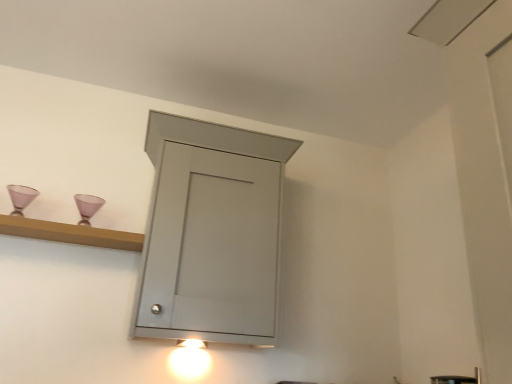
The image size is (512, 384). Describe the element at coordinates (189, 359) in the screenshot. I see `matte white light fixture at lower center` at that location.

Where is `matte white light fixture at lower center`? Image resolution: width=512 pixels, height=384 pixels. matte white light fixture at lower center is located at coordinates (189, 359).

Locate an element on the screen. matte gray cabinet at center is located at coordinates (193, 215).

From the image's perspective, is wooden shelf at upper left located above or below satin nickel faucet at lower right?

From the image's perspective, wooden shelf at upper left appears above satin nickel faucet at lower right.

Is wooden shelf at upper left further to the viewer compared to satin nickel faucet at lower right?

Yes, the depth of wooden shelf at upper left is greater than that of satin nickel faucet at lower right.

From a real-world perspective, which is physically below, wooden shelf at upper left or satin nickel faucet at lower right?

satin nickel faucet at lower right, from a real-world perspective.

Is wooden shelf at upper left next to satin nickel faucet at lower right and touching it?

They are not placed beside each other.

Considering the relative positions of wooden shelf at upper left and matte white light fixture at lower center in the image provided, is wooden shelf at upper left in front of matte white light fixture at lower center?

Yes, wooden shelf at upper left is closer to the camera.

I want to click on shelf above the matte white light fixture at lower center (from the image's perspective), so click(x=70, y=233).

From the image's perspective, is wooden shelf at upper left located above or below matte white light fixture at lower center?

wooden shelf at upper left is situated higher than matte white light fixture at lower center in the image.

Does point (6, 228) come behind point (190, 348)?

No, it is not.

Is satin nickel faucet at lower right bigger or smaller than wooden shelf at upper left?

Clearly, satin nickel faucet at lower right is smaller in size than wooden shelf at upper left.

Which of these two, satin nickel faucet at lower right or wooden shelf at upper left, is wider?

Wider between the two is wooden shelf at upper left.

From the image's perspective, is satin nickel faucet at lower right above wooden shelf at upper left?

No, from the image's perspective, satin nickel faucet at lower right is not above wooden shelf at upper left.

Which is closer to the camera, (453,377) or (71,241)?

Positioned in front is point (453,377).

Considering the sizes of satin nickel faucet at lower right and matte gray cabinet at center in the image, is satin nickel faucet at lower right taller or shorter than matte gray cabinet at center?

Clearly, satin nickel faucet at lower right is shorter compared to matte gray cabinet at center.

From the image's perspective, is satin nickel faucet at lower right above matte gray cabinet at center?

Actually, satin nickel faucet at lower right appears below matte gray cabinet at center in the image.

Considering the relative positions of satin nickel faucet at lower right and matte gray cabinet at center in the image provided, is satin nickel faucet at lower right to the left of matte gray cabinet at center from the viewer's perspective?

No, satin nickel faucet at lower right is not to the left of matte gray cabinet at center.

Find the location of a particular element. The width and height of the screenshot is (512, 384). faucet located underneath the matte gray cabinet at center (from a real-world perspective) is located at coordinates (457, 379).

Is point (223, 319) in front of point (430, 377)?

Yes.

In order to click on cupboard behind the satin nickel faucet at lower right in this screenshot , I will do `click(193, 215)`.

Could you tell me if matte gray cabinet at center is facing satin nickel faucet at lower right?

No, matte gray cabinet at center is not aimed at satin nickel faucet at lower right.

From a real-world perspective, who is located higher, matte white light fixture at lower center or satin nickel faucet at lower right?

matte white light fixture at lower center, from a real-world perspective.

From the image's perspective, between matte white light fixture at lower center and satin nickel faucet at lower right, who is located below?

matte white light fixture at lower center appears lower in the image.

Find the location of a particular element. Image resolution: width=512 pixels, height=384 pixels. light fixture located above the satin nickel faucet at lower right (from a real-world perspective) is located at coordinates (189, 359).

Measure the distance between matte white light fixture at lower center and satin nickel faucet at lower right.

They are 3.32 feet apart.

Is point (180, 355) less distant than point (144, 311)?

No, it is not.

Does matte white light fixture at lower center have a greater height compared to matte gray cabinet at center?

In fact, matte white light fixture at lower center may be shorter than matte gray cabinet at center.

This screenshot has height=384, width=512. Identify the location of light fixture behind the matte gray cabinet at center. (189, 359).

Does matte white light fixture at lower center turn towards matte gray cabinet at center?

No, matte white light fixture at lower center is not turned towards matte gray cabinet at center.

In the image, there is a satin nickel faucet at lower right. Identify the location of shelf above it (from the image's perspective). (70, 233).

You are a GUI agent. You are given a task and a screenshot of the screen. Output one action in this format:
    pyautogui.click(x=<x>, y=<y>)
    Task: Click on the shelf on the left of the matte white light fixture at lower center
    
    Given the screenshot: What is the action you would take?
    pyautogui.click(x=70, y=233)

Considering their positions, is satin nickel faucet at lower right positioned further to wooden shelf at upper left than matte white light fixture at lower center?

satin nickel faucet at lower right.

Looking at the image, which one is located further to matte white light fixture at lower center, wooden shelf at upper left or matte gray cabinet at center?

Based on the image, wooden shelf at upper left appears to be further to matte white light fixture at lower center.

From the image, which object appears to be farther from wooden shelf at upper left, matte white light fixture at lower center or satin nickel faucet at lower right?

satin nickel faucet at lower right is positioned further to the anchor wooden shelf at upper left.

Looking at the image, which one is located closer to matte gray cabinet at center, wooden shelf at upper left or matte white light fixture at lower center?

The object closer to matte gray cabinet at center is wooden shelf at upper left.

When comparing their distances from matte white light fixture at lower center, does matte gray cabinet at center or wooden shelf at upper left seem further?

Among the two, wooden shelf at upper left is located further to matte white light fixture at lower center.

From the image, which object appears to be farther from matte white light fixture at lower center, satin nickel faucet at lower right or wooden shelf at upper left?

satin nickel faucet at lower right.

Estimate the real-world distances between objects in this image. Which object is closer to matte gray cabinet at center, wooden shelf at upper left or satin nickel faucet at lower right?

wooden shelf at upper left is closer to matte gray cabinet at center.

Which object lies further to the anchor point matte gray cabinet at center, satin nickel faucet at lower right or wooden shelf at upper left?

Based on the image, satin nickel faucet at lower right appears to be further to matte gray cabinet at center.

Locate an element on the screen. This screenshot has width=512, height=384. cupboard between matte white light fixture at lower center and satin nickel faucet at lower right is located at coordinates (193, 215).

What are the coordinates of `cupboard between wooden shelf at upper left and matte white light fixture at lower center vertically` in the screenshot? It's located at (193, 215).

The image size is (512, 384). Find the location of `cupboard between wooden shelf at upper left and satin nickel faucet at lower right`. cupboard between wooden shelf at upper left and satin nickel faucet at lower right is located at coordinates (193, 215).

This screenshot has width=512, height=384. I want to click on light fixture situated between wooden shelf at upper left and satin nickel faucet at lower right from left to right, so click(x=189, y=359).